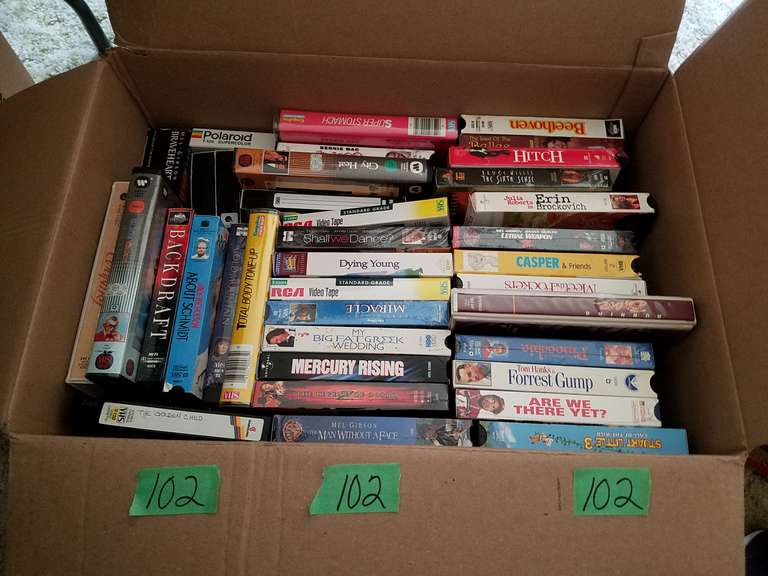
Locate an element on the screen. pale thick carpet is located at coordinates (693, 18), (61, 26).